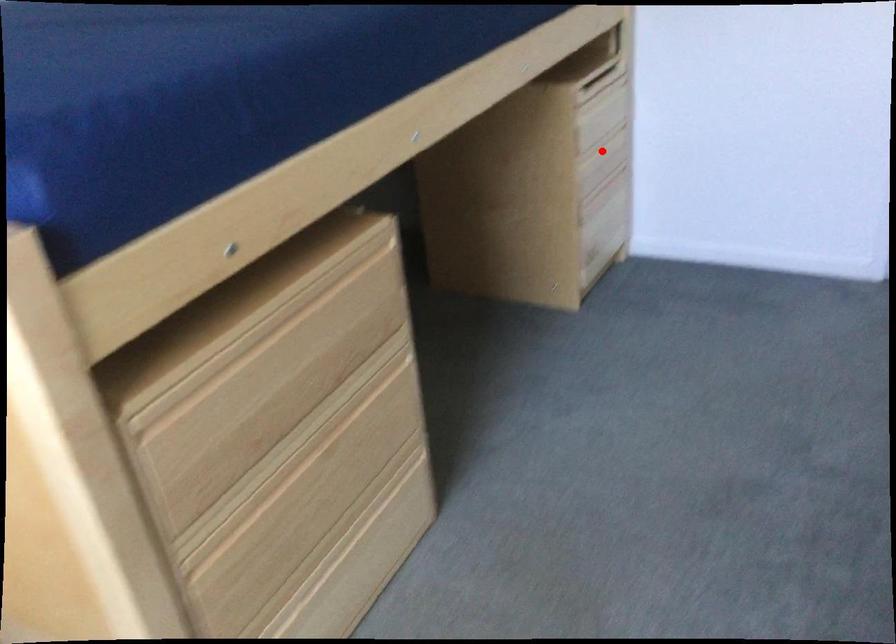
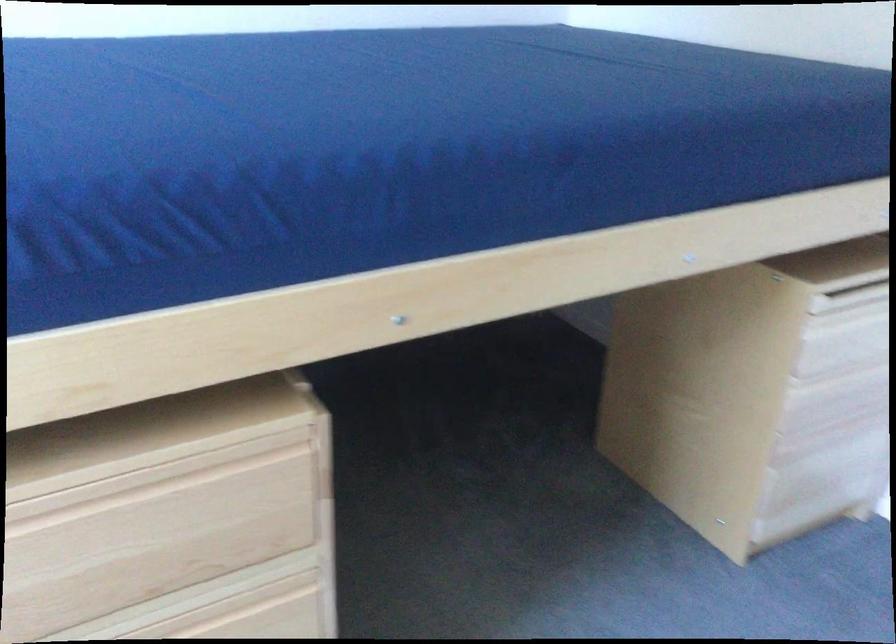
In the second image, find the point that corresponds to the highlighted location in the first image.

(845, 381)